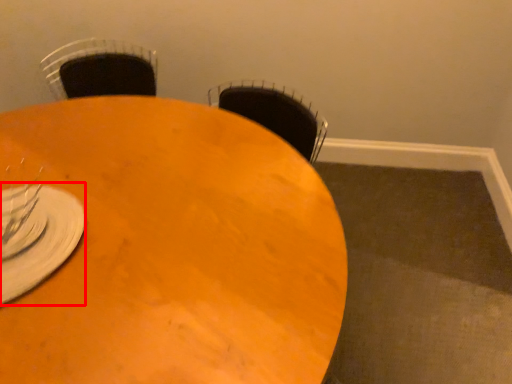
Question: From the image's perspective, where is tableware (annotated by the red box) located in relation to table in the image?

Choices:
 (A) below
 (B) above

Answer: (B)